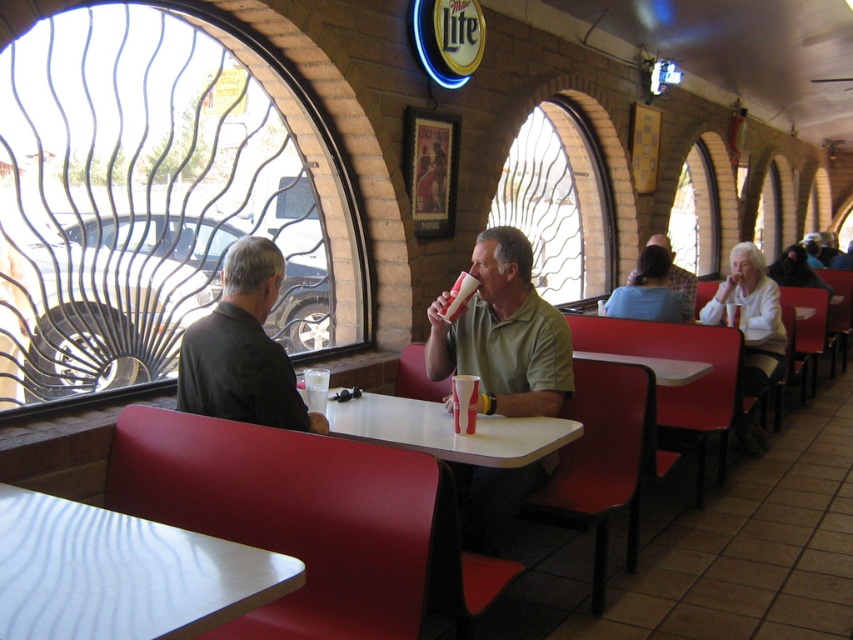
You are a customer sitting at a booth in the diner and want to reach the exit door. You notice two points marked in the image. The first point is at coordinate point(199,611) and the second is at point(503,465). Which point is closer to the exit door?

Point(199,611) is in front of point(503,465), so the first point is closer to the exit door.